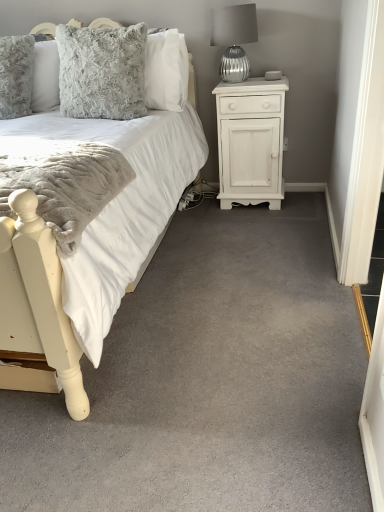
Question: Is fluffy gray pillow at upper left inside silver textured glass at upper right?

Choices:
 (A) yes
 (B) no

Answer: (B)

Question: Can you confirm if silver textured glass at upper right is bigger than fluffy gray pillow at upper left?

Choices:
 (A) yes
 (B) no

Answer: (B)

Question: Is silver textured glass at upper right at the right side of fluffy gray pillow at upper left?

Choices:
 (A) yes
 (B) no

Answer: (A)

Question: Is silver textured glass at upper right not inside fluffy gray pillow at upper left?

Choices:
 (A) no
 (B) yes

Answer: (B)

Question: Considering the relative sizes of silver textured glass at upper right and fluffy gray pillow at upper left in the image provided, is silver textured glass at upper right wider than fluffy gray pillow at upper left?

Choices:
 (A) no
 (B) yes

Answer: (B)

Question: Considering the relative positions of silver textured glass at upper right and white soft carpet at center in the image provided, is silver textured glass at upper right to the left or to the right of white soft carpet at center?

Choices:
 (A) right
 (B) left

Answer: (A)

Question: From their relative heights in the image, would you say silver textured glass at upper right is taller or shorter than white soft carpet at center?

Choices:
 (A) tall
 (B) short

Answer: (A)

Question: Considering the positions of point (241, 41) and point (231, 359), is point (241, 41) closer or farther from the camera than point (231, 359)?

Choices:
 (A) closer
 (B) farther

Answer: (B)

Question: Looking at the image, does silver textured glass at upper right seem bigger or smaller compared to white soft carpet at center?

Choices:
 (A) big
 (B) small

Answer: (B)

Question: From a real-world perspective, relative to silver textured glass at upper right, is white soft carpet at center vertically above or below?

Choices:
 (A) above
 (B) below

Answer: (B)

Question: Visually, is white soft carpet at center positioned to the left or to the right of silver textured glass at upper right?

Choices:
 (A) left
 (B) right

Answer: (A)

Question: In terms of size, does white soft carpet at center appear bigger or smaller than silver textured glass at upper right?

Choices:
 (A) small
 (B) big

Answer: (B)

Question: Considering their positions, is white soft carpet at center located in front of or behind silver textured glass at upper right?

Choices:
 (A) front
 (B) behind

Answer: (A)

Question: From their relative heights in the image, would you say white soft fabric bed at left is taller or shorter than white soft carpet at center?

Choices:
 (A) tall
 (B) short

Answer: (A)

Question: Is white soft fabric bed at left bigger or smaller than white soft carpet at center?

Choices:
 (A) big
 (B) small

Answer: (A)